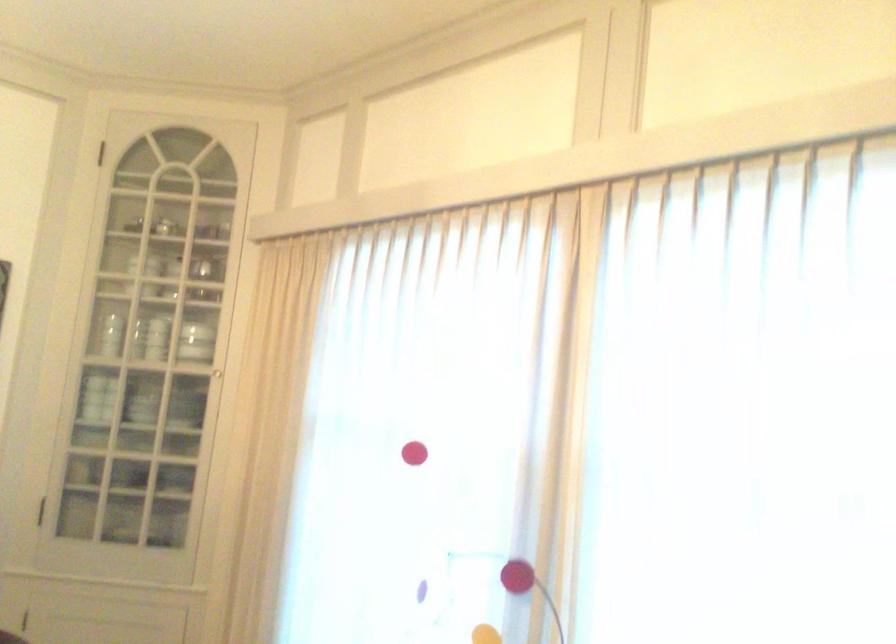
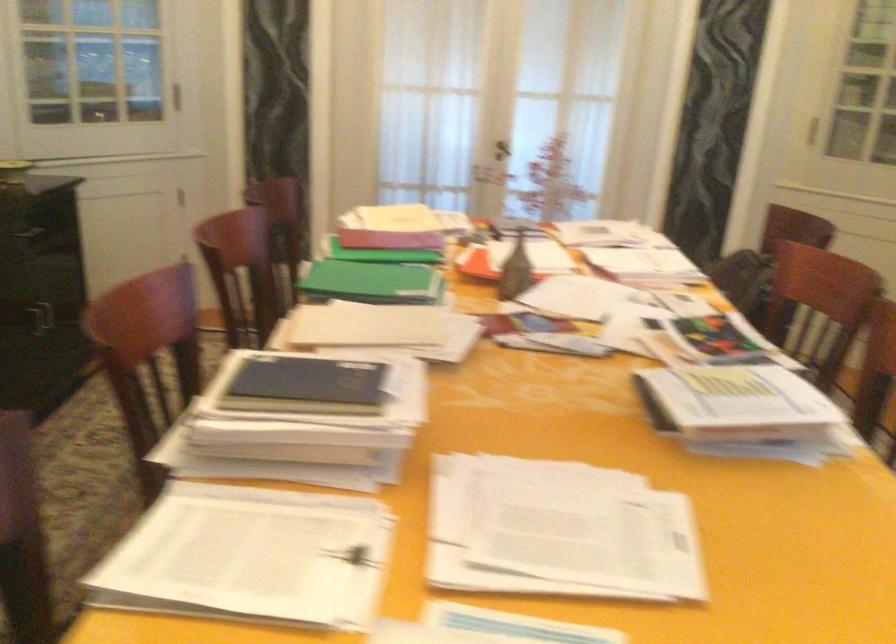
The first image is from the beginning of the video and the second image is from the end. How did the camera likely rotate when shooting the video?

The camera rotated toward left-down.